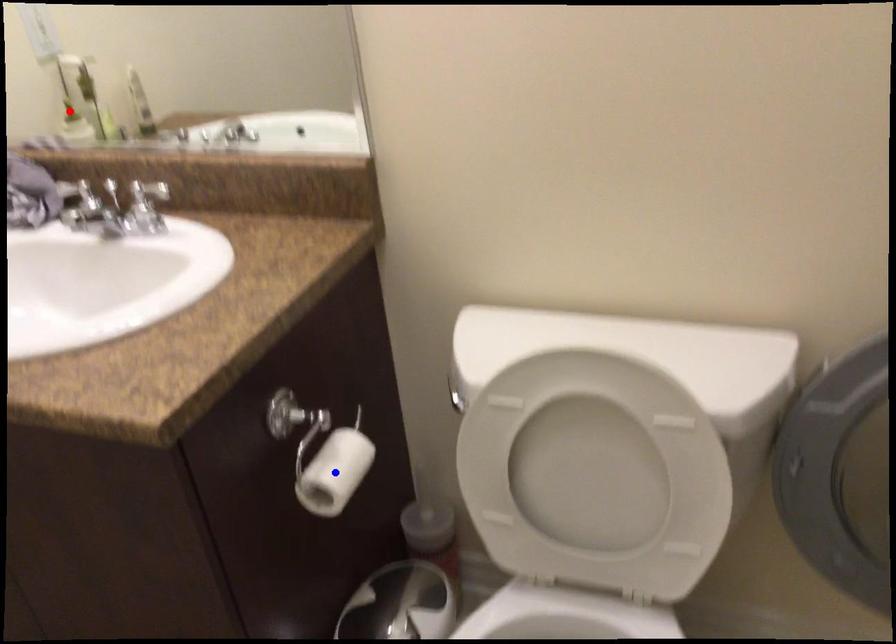
Question: In the image, two points are highlighted. Which point is nearer to the camera? Reply with the corresponding letter.

Choices:
 (A) blue point
 (B) red point

Answer: (A)